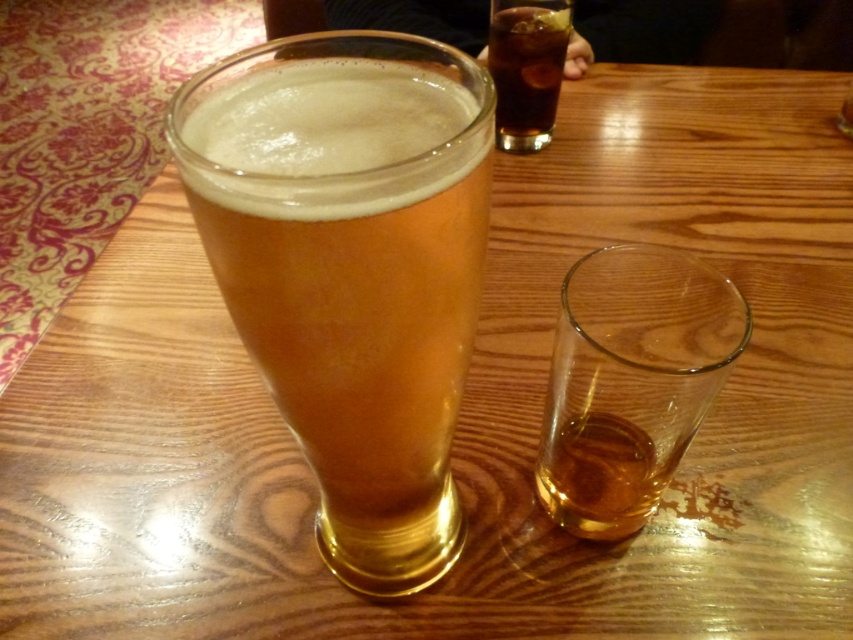
What do you see at coordinates (358, 312) in the screenshot? I see `golden glass at center` at bounding box center [358, 312].

Find the location of a particular element. The image size is (853, 640). golden glass at center is located at coordinates click(x=358, y=312).

The width and height of the screenshot is (853, 640). I want to click on translucent glass at lower right, so click(x=631, y=381).

Can you confirm if translucent glass at lower right is bigger than dark brown glass at upper center?

Indeed, translucent glass at lower right has a larger size compared to dark brown glass at upper center.

Measure the distance between translucent glass at lower right and camera.

translucent glass at lower right and camera are 8.45 inches apart.

The image size is (853, 640). What are the coordinates of `translucent glass at lower right` in the screenshot? It's located at (631, 381).

Does point (355, 584) come closer to viewer compared to point (567, 285)?

That is False.

Does golden glass at center have a greater width compared to translucent glass at lower right?

Indeed, golden glass at center has a greater width compared to translucent glass at lower right.

Is point (396, 54) positioned after point (703, 326)?

That is False.

Find the location of a particular element. golden glass at center is located at coordinates (358, 312).